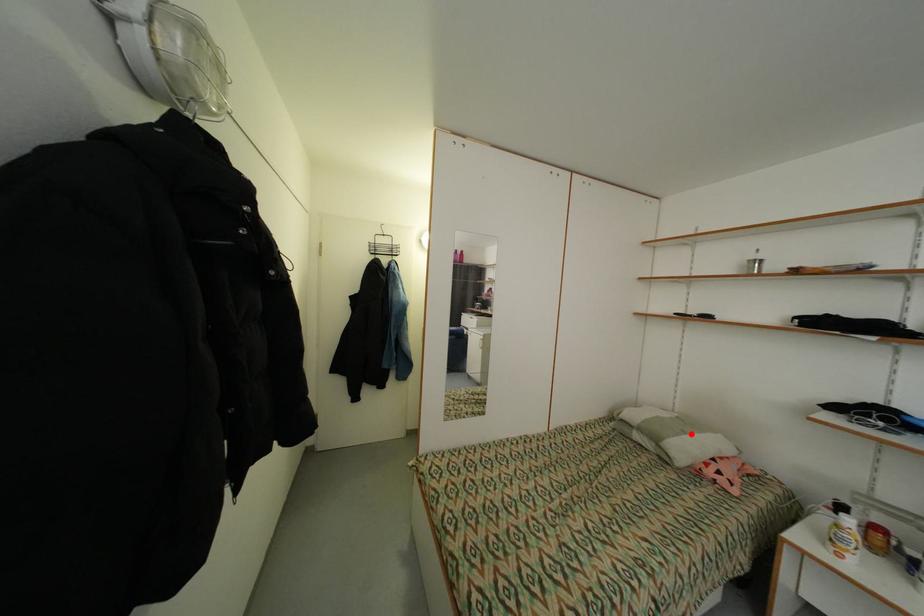
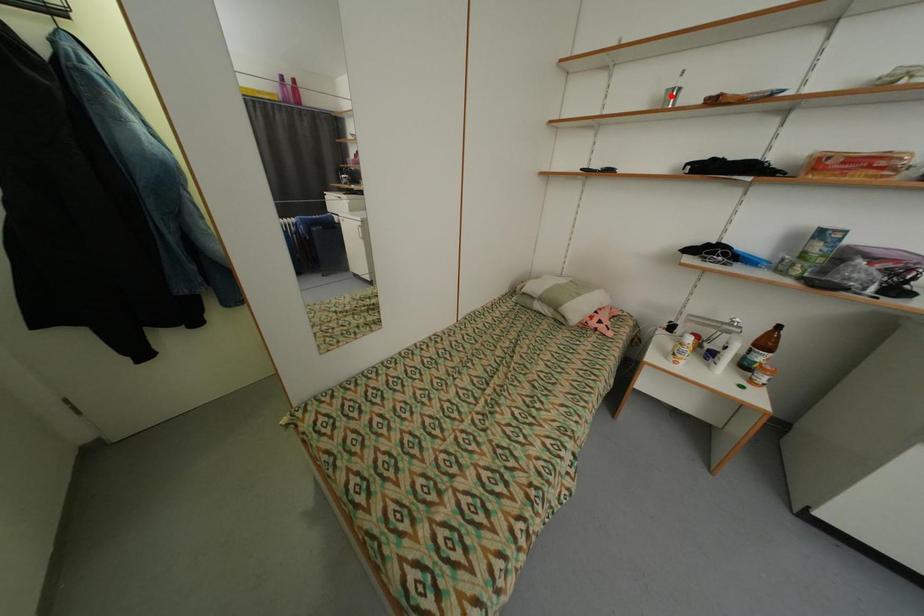
I am providing you with two images of the same scene from different viewpoints. A red point is marked on the first image and another point is marked on the second image. Does the point marked in image1 correspond to the same location as the one in image2?

No